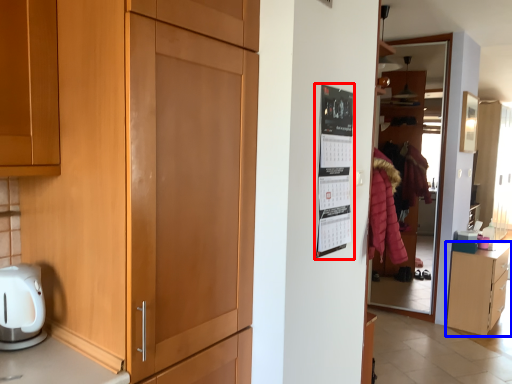
Question: Which point is further to the camera, bulletin board (highlighted by a red box) or cabinetry (highlighted by a blue box)?

Choices:
 (A) bulletin board
 (B) cabinetry

Answer: (B)